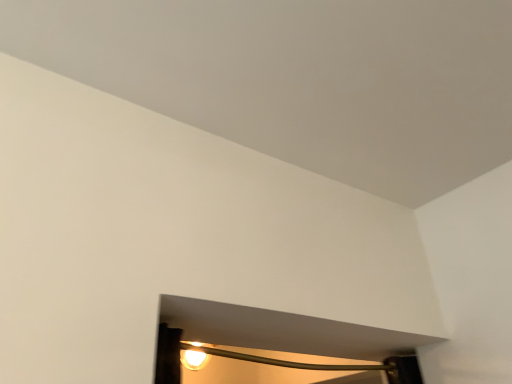
What do you see at coordinates (326, 364) in the screenshot? The image size is (512, 384). I see `matte gold lamp at lower center` at bounding box center [326, 364].

Find the location of a particular element. matte gold lamp at lower center is located at coordinates (326, 364).

Find the location of a particular element. Image resolution: width=512 pixels, height=384 pixels. matte gold lamp at lower center is located at coordinates (326, 364).